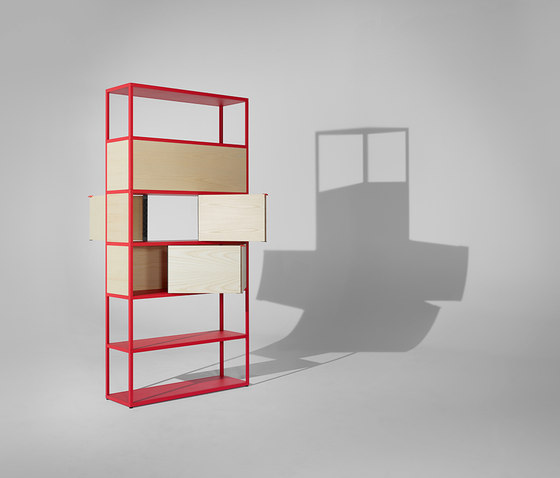
Identify the location of reflection of red bar on ceiling of shelf. (222, 100).